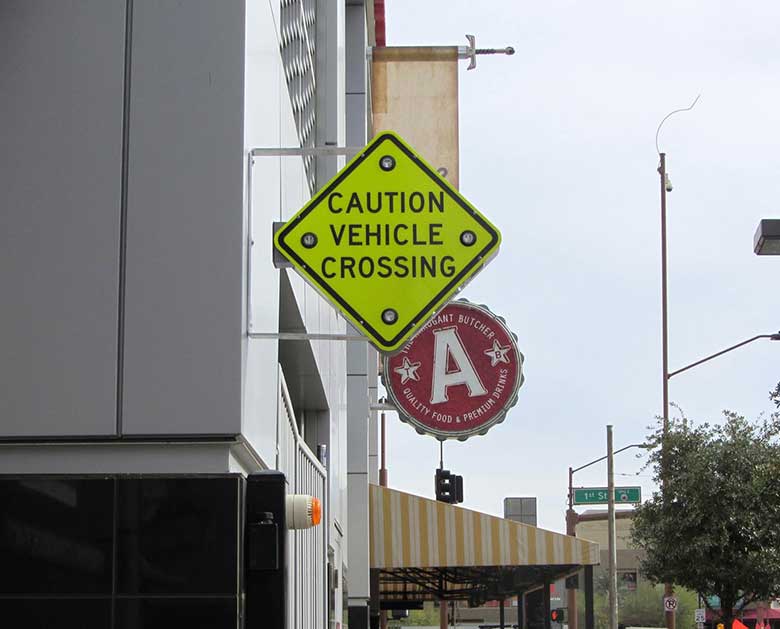
Where is `wall`? wall is located at coordinates (115, 170).